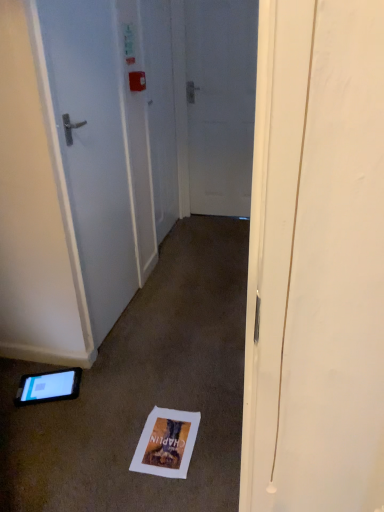
What are the coordinates of `vacant space situated on the left part of white paper postcard at lower center` in the screenshot? It's located at (98, 454).